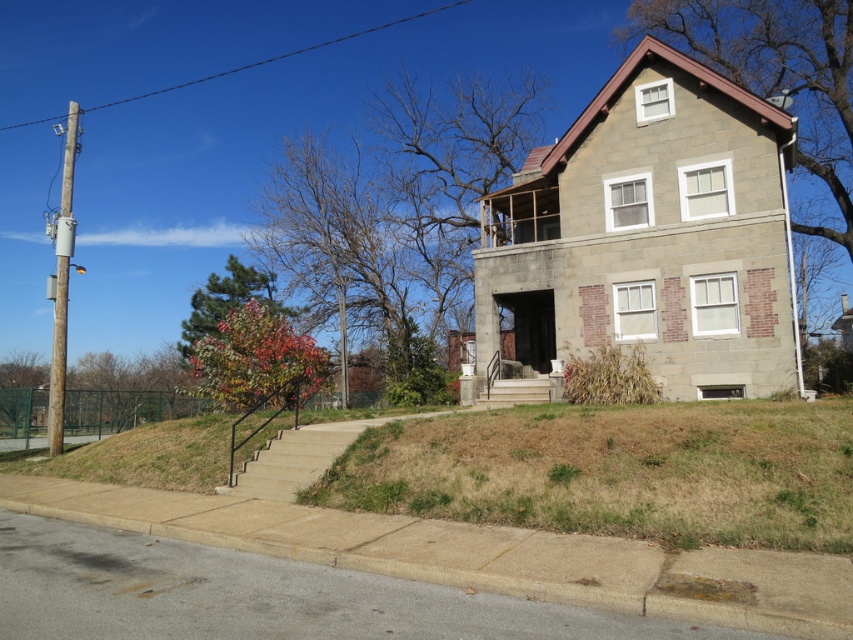
Looking at this image, you are a delivery person approaching the house and need to reach the entrance. You see the gray concrete curb at lower center and the stone steps at center. Which object should you step over first to get to the entrance?

The gray concrete curb at lower center is in front of the stone steps at center, so you should step over the gray concrete curb at lower center first before proceeding up the stone steps at center to reach the entrance.

You are a delivery person with a 10 feet wide truck. You need to park your truck between the gray concrete curb at lower center and the nearest object. Is there enough space?

The gray concrete curb at lower center and the nearest object are 14.49 feet apart, which is more than the truck width of 10 feet. Therefore, the truck can be parked between them.